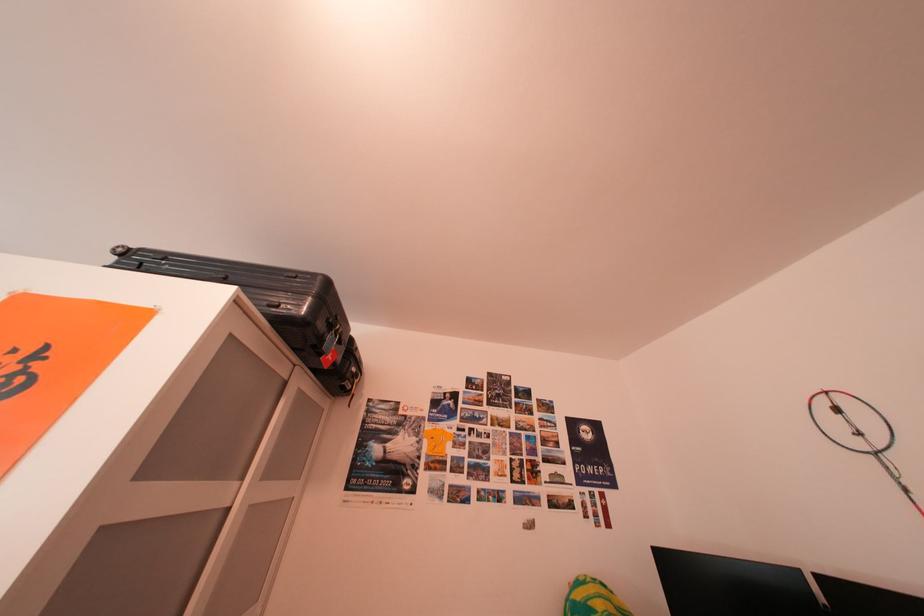
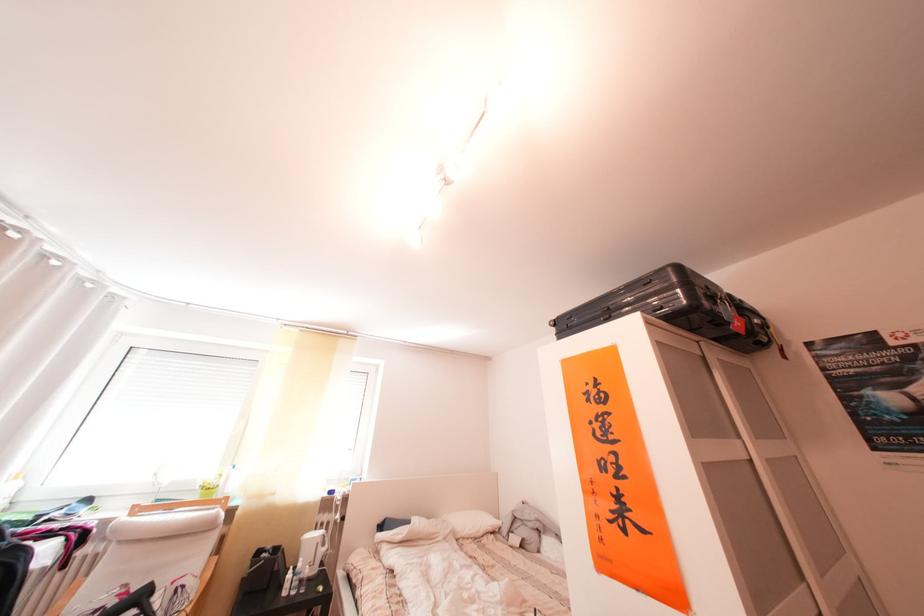
Where in the second image is the point corresponding to (307,354) from the first image?

(703, 336)